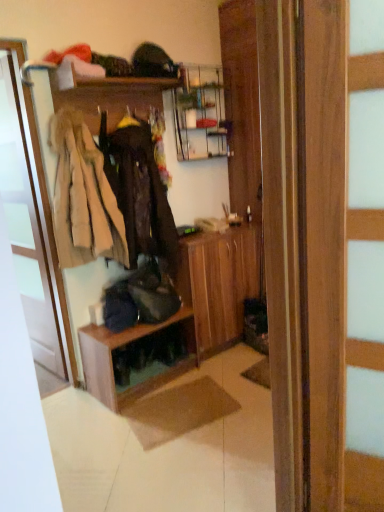
Question: Visually, is wooden dresser at center positioned to the left or to the right of dark brown leather jacket at center, which ranks as the 1th clothing in right-to-left order?

Choices:
 (A) right
 (B) left

Answer: (A)

Question: Relative to dark brown leather jacket at center, which ranks as the 1th clothing in right-to-left order, is wooden dresser at center in front or behind?

Choices:
 (A) behind
 (B) front

Answer: (B)

Question: Estimate the real-world distances between objects in this image. Which object is closer to the beige fur coat at left, the first clothing viewed from the left?

Choices:
 (A) dark brown leather jacket at center, which ranks as the 1th clothing in right-to-left order
 (B) wooden coat rack at upper left, the 1th shelf positioned from the top
 (C) wooden shelf at center, the second shelf in the top-to-bottom sequence
 (D) white glossy door at left
 (E) wooden dresser at center

Answer: (A)

Question: Based on their relative distances, which object is farther from the wooden coat rack at upper left, the 1th shelf positioned from the top?

Choices:
 (A) wooden shelf at center, the 1th shelf positioned from the bottom
 (B) white glossy door at left
 (C) dark brown leather jacket at center, which ranks as the 1th clothing in right-to-left order
 (D) wooden dresser at center
 (E) beige fur coat at left, placed as the 2th clothing when sorted from right to left

Answer: (A)